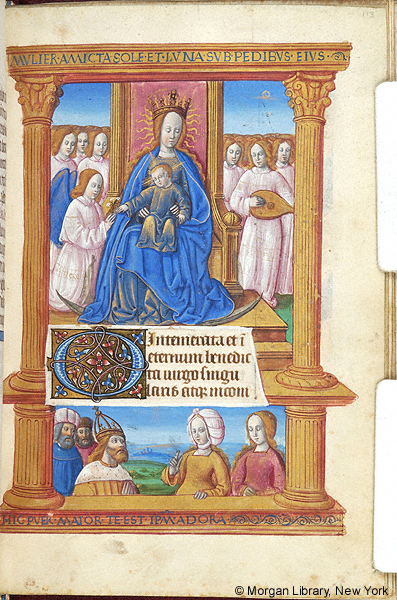
Locate an element on the screen. The height and width of the screenshot is (600, 397). lower pillars is located at coordinates (39, 446), (306, 460).